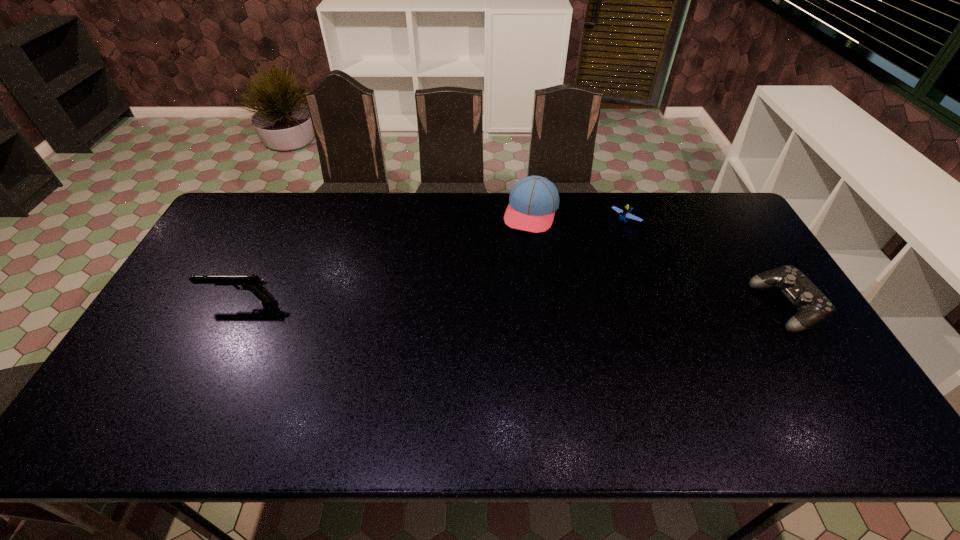
Locate an element on the screen. The height and width of the screenshot is (540, 960). free point located 0.300m on the front-facing side of the baseball cap is located at coordinates (500, 299).

Find the location of a particular element. This screenshot has width=960, height=540. free space located on the front-facing side of the second object from right to left is located at coordinates (602, 241).

This screenshot has width=960, height=540. I want to click on blank space located 0.190m on the front-facing side of the second object from right to left, so click(588, 255).

Identify the location of vacant space located on the front-facing side of the second object from right to left. This screenshot has width=960, height=540. (550, 289).

Where is `baseball cap present at the far edge`? Image resolution: width=960 pixels, height=540 pixels. baseball cap present at the far edge is located at coordinates (533, 200).

Locate an element on the screen. Lego present at the far edge is located at coordinates (624, 214).

This screenshot has height=540, width=960. In order to click on object at the left edge in this screenshot , I will do `click(253, 283)`.

This screenshot has width=960, height=540. What are the coordinates of `object present at the right edge` in the screenshot? It's located at (813, 306).

This screenshot has width=960, height=540. In the image, there is a desktop. In order to click on vacant space at the far edge in this screenshot , I will do `click(435, 198)`.

Where is `free spot at the near edge of the desktop`? The width and height of the screenshot is (960, 540). free spot at the near edge of the desktop is located at coordinates (332, 395).